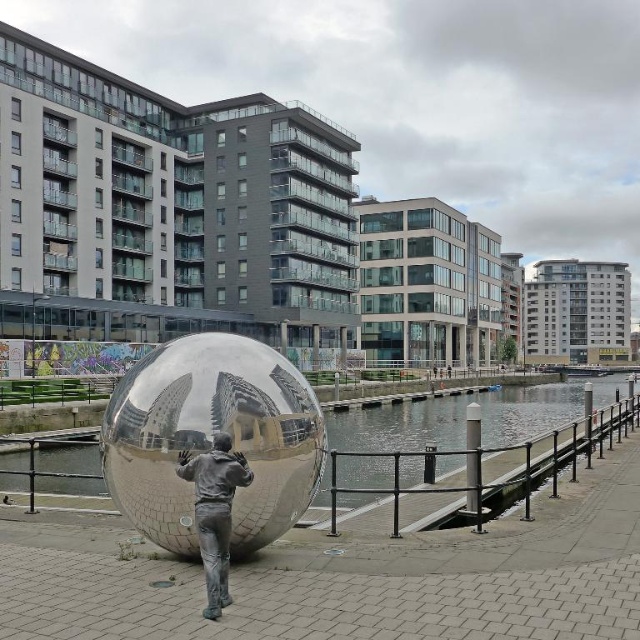
Can you confirm if glossy metallic water at center is thinner than silver reflective statue at center?

Incorrect, glossy metallic water at center's width is not less than silver reflective statue at center's.

Does glossy metallic water at center appear on the right side of silver reflective statue at center?

Indeed, glossy metallic water at center is positioned on the right side of silver reflective statue at center.

Which is behind, point (605, 380) or point (209, 595)?

Positioned behind is point (605, 380).

The image size is (640, 640). I want to click on glossy metallic water at center, so click(x=464, y=417).

Who is taller, shiny metallic sphere at center or glossy metallic water at center?

glossy metallic water at center is taller.

Is shiny metallic sphere at center positioned in front of glossy metallic water at center?

Yes, it is.

Is point (259, 536) closer to camera compared to point (86, 481)?

Yes, it is.

Find the location of `shiny metallic sphere at center`. shiny metallic sphere at center is located at coordinates (211, 436).

Between shiny metallic sphere at center and silver reflective statue at center, which one is positioned lower?

silver reflective statue at center is below.

Can you confirm if shiny metallic sphere at center is positioned to the left of silver reflective statue at center?

Correct, you'll find shiny metallic sphere at center to the left of silver reflective statue at center.

Find the location of a particular element. The image size is (640, 640). shiny metallic sphere at center is located at coordinates (211, 436).